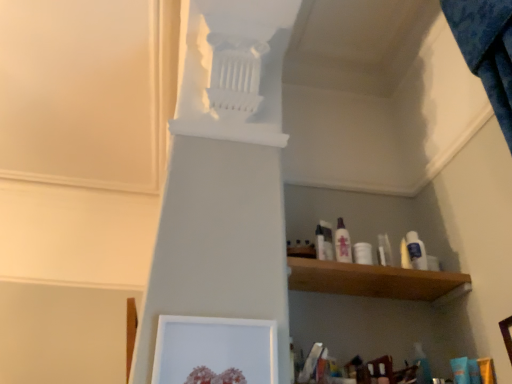
Question: Is white plastic bottle at center, placed as the first toiletry when sorted from left to right, to the left or to the right of white glossy lotion at upper center, placed as the second toiletry when sorted from right to left, in the image?

Choices:
 (A) left
 (B) right

Answer: (A)

Question: From their relative heights in the image, would you say white plastic bottle at center, which is the 3th toiletry from right to left, is taller or shorter than white glossy lotion at upper center, the second toiletry when ordered from left to right?

Choices:
 (A) short
 (B) tall

Answer: (A)

Question: Estimate the real-world distances between objects in this image. Which object is closer to the white plastic bottle at center, which is the 3th toiletry from right to left?

Choices:
 (A) white glossy lotion at upper center, placed as the second toiletry when sorted from right to left
 (B) white plastic bottle at upper right, which is the 1th toiletry from right to left
 (C) white matte picture frame at lower center

Answer: (A)

Question: Which of these objects is positioned farthest from the white plastic bottle at upper right, which is the 1th toiletry from right to left?

Choices:
 (A) white plastic bottle at center, placed as the first toiletry when sorted from left to right
 (B) white glossy lotion at upper center, placed as the second toiletry when sorted from right to left
 (C) white matte picture frame at lower center

Answer: (C)